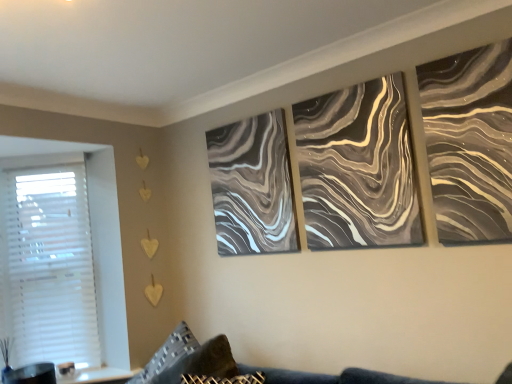
Question: Considering the positions of marble-like gray painting at center, marked as the 2th canvas in a front-to-back arrangement, and metallic swirl canvas at center, the 2th canvas from the back, in the image, is marble-like gray painting at center, marked as the 2th canvas in a front-to-back arrangement, bigger or smaller than metallic swirl canvas at center, the 2th canvas from the back,?

Choices:
 (A) small
 (B) big

Answer: (B)

Question: In the image, is marble-like gray painting at center, positioned as the first canvas in left-to-right order, on the left side or the right side of metallic swirl canvas at center, the 2th canvas from the back?

Choices:
 (A) left
 (B) right

Answer: (A)

Question: Based on their relative distances, which object is nearer to the velvet dark blue couch at lower center?

Choices:
 (A) white plastic blinds at left
 (B) metallic swirl canvas at center, the 2th canvas from the back
 (C) textured gray pillow at lower left
 (D) metallic silver abstract art at upper right
 (E) marble-like gray painting at center, positioned as the first canvas in left-to-right order

Answer: (C)

Question: Estimate the real-world distances between objects in this image. Which object is farther from the metallic silver abstract art at upper right?

Choices:
 (A) white plastic blinds at left
 (B) velvet dark blue couch at lower center
 (C) marble-like gray painting at center, marked as the 2th canvas in a front-to-back arrangement
 (D) metallic swirl canvas at center, the 2th canvas from the back
 (E) textured gray pillow at lower left

Answer: (A)